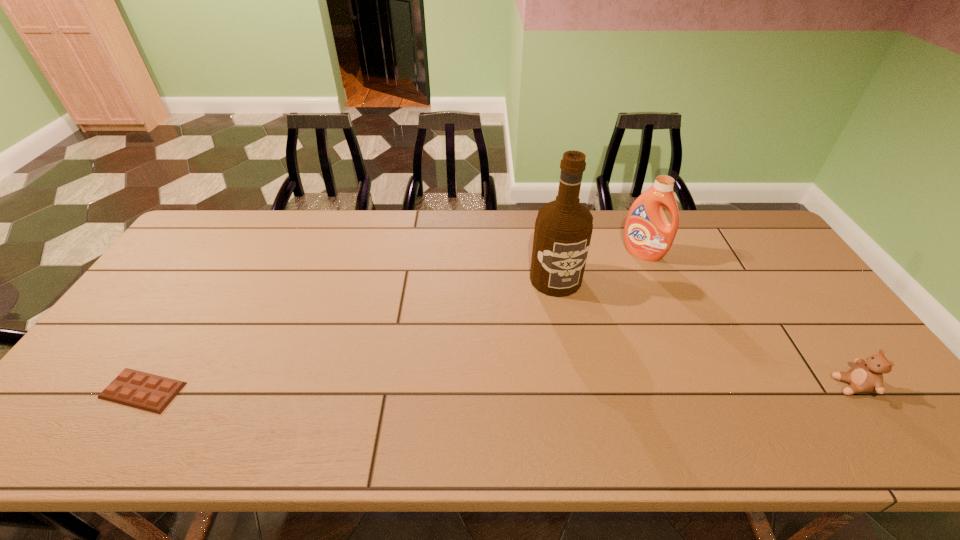
You are a GUI agent. You are given a task and a screenshot of the screen. Output one action in this format:
    pyautogui.click(x=<x>, y=<y>)
    Task: Click on the vacant region located 0.370m on the front-facing side of the second shortest object
    
    Given the screenshot: What is the action you would take?
    pyautogui.click(x=683, y=386)

The width and height of the screenshot is (960, 540). Identify the location of vacant space located on the front-facing side of the second shortest object. (753, 386).

Locate an element on the screen. vacant region located 0.170m on the label of the second object from left to right is located at coordinates (582, 343).

At what (x,y) coordinates should I click in order to perform the action: click on free spot located 0.160m on the label of the second object from left to right. Please return your answer as a coordinate pair (x, y). Image resolution: width=960 pixels, height=540 pixels. Looking at the image, I should click on (581, 340).

Where is `vacant region located on the label of the second object from left to right`? vacant region located on the label of the second object from left to right is located at coordinates (575, 326).

Locate an element on the screen. This screenshot has height=540, width=960. vacant space located 0.320m on the front-facing side of the third shortest object is located at coordinates (588, 322).

Where is `vacant point located 0.380m on the front-facing side of the third shortest object`? This screenshot has height=540, width=960. vacant point located 0.380m on the front-facing side of the third shortest object is located at coordinates (578, 336).

Image resolution: width=960 pixels, height=540 pixels. What are the coordinates of `vacant space situated 0.290m on the front-facing side of the third shortest object` in the screenshot? It's located at (592, 316).

Find the location of a particular element. object at the far edge is located at coordinates (648, 235).

The height and width of the screenshot is (540, 960). Identify the location of chocolate bar that is at the near edge. (145, 391).